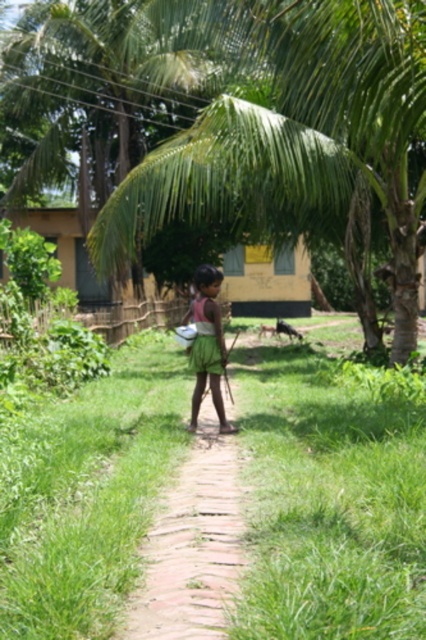
Question: Considering the real-world distances, which object is farthest from the green fabric skirt at center?

Choices:
 (A) green grass at center
 (B) green leafy coconut tree at center

Answer: (B)

Question: Does green grass at center appear on the left side of green fabric skirt at center?

Choices:
 (A) no
 (B) yes

Answer: (A)

Question: Which point appears closest to the camera in this image?

Choices:
 (A) (14, 502)
 (B) (302, 86)
 (C) (198, 285)

Answer: (A)

Question: Is green grass at center positioned in front of green leafy coconut tree at center?

Choices:
 (A) no
 (B) yes

Answer: (B)

Question: In this image, where is green leafy coconut tree at center located relative to green fabric skirt at center?

Choices:
 (A) left
 (B) right

Answer: (A)

Question: Which point is closer to the camera?

Choices:
 (A) (170, 376)
 (B) (215, 365)

Answer: (B)